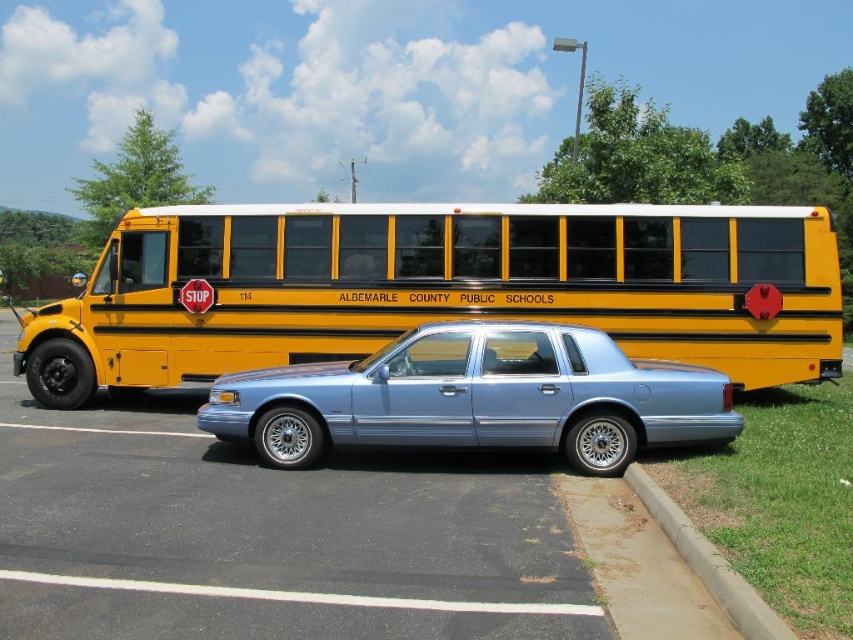
Question: Observing the image, what is the correct spatial positioning of yellow matte bus at center in reference to metallic blue sedan at center?

Choices:
 (A) above
 (B) below

Answer: (A)

Question: In this image, where is metallic blue sedan at center located relative to concrete at lower right?

Choices:
 (A) above
 (B) below

Answer: (A)

Question: Does yellow matte bus at center lie in front of concrete at lower right?

Choices:
 (A) yes
 (B) no

Answer: (B)

Question: Which point appears closest to the camera in this image?

Choices:
 (A) (86, 387)
 (B) (639, 490)
 (C) (573, 452)

Answer: (B)

Question: Among these points, which one is farthest from the camera?

Choices:
 (A) (170, 314)
 (B) (614, 422)

Answer: (A)

Question: Estimate the real-world distances between objects in this image. Which object is farther from the metallic blue sedan at center?

Choices:
 (A) yellow matte bus at center
 (B) concrete at lower right

Answer: (A)